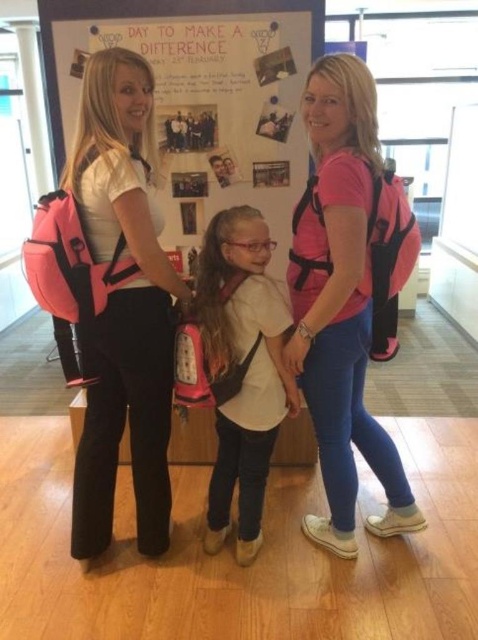
How far apart are matte pink backpack at left and pink fabric backpack at center?

matte pink backpack at left and pink fabric backpack at center are 30.83 centimeters apart from each other.

Can you confirm if matte pink backpack at left is thinner than pink fabric backpack at center?

No, matte pink backpack at left is not thinner than pink fabric backpack at center.

Is point (102, 248) positioned after point (230, 461)?

No, it is not.

Identify the location of matte pink backpack at left. This screenshot has height=640, width=478. (123, 305).

Is pink matte backpack at center below pink fabric backpack at center?

Incorrect, pink matte backpack at center is not positioned below pink fabric backpack at center.

Can you confirm if pink matte backpack at center is wider than pink fabric backpack at center?

Yes.

Identify the location of pink matte backpack at center. This screenshot has width=478, height=640. (347, 296).

The width and height of the screenshot is (478, 640). Identify the location of pink matte backpack at center. (347, 296).

Find the location of `pink matte backpack at center`. pink matte backpack at center is located at coordinates (347, 296).

The width and height of the screenshot is (478, 640). Identify the location of pink matte backpack at center. 347,296.